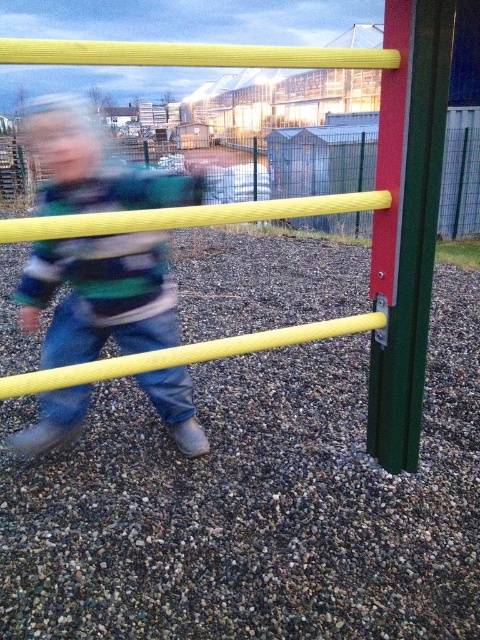
You are a parent supervising children at the playground. You notice the matte yellow pole at center and the green matte pole at right. Which pole is shorter?

The matte yellow pole at center is smaller than the green matte pole at right, so the matte yellow pole at center is shorter.

You are a maintenance worker checking the playground equipment. You need to reach both the matte yellow pole at center and the green matte pole at right. Which pole should you attend to first if you want to start with the one closer to your current position?

You should attend to the matte yellow pole at center first because it is closer to you than the green matte pole at right, which is further away.